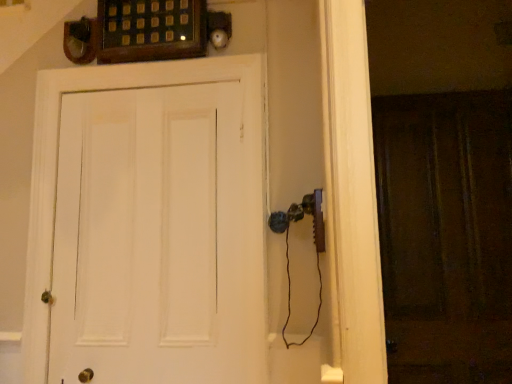
Locate an element on the screen. empty space that is ontop of white matte door at center (from a real-world perspective) is located at coordinates (140, 62).